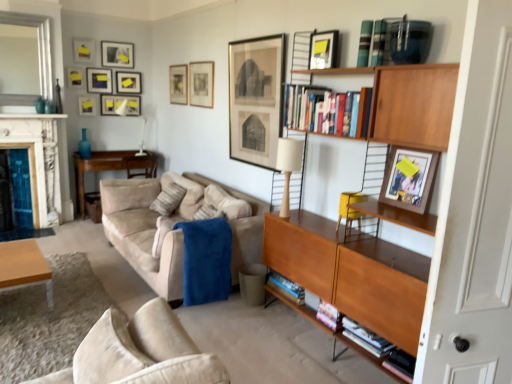
Question: Is marble fireplace at left further to the viewer compared to matte black picture frame at upper center, acting as the tenth picture frame starting from the left?

Choices:
 (A) no
 (B) yes

Answer: (B)

Question: From a real-world perspective, is marble fireplace at left positioned over matte black picture frame at upper center, which ranks as the third picture frame in front-to-back order, based on gravity?

Choices:
 (A) no
 (B) yes

Answer: (A)

Question: Does marble fireplace at left appear on the right side of matte black picture frame at upper center, the 3th picture frame positioned from the right?

Choices:
 (A) yes
 (B) no

Answer: (B)

Question: Are marble fireplace at left and matte black picture frame at upper center, which ranks as the third picture frame in front-to-back order, located far from each other?

Choices:
 (A) yes
 (B) no

Answer: (A)

Question: Is marble fireplace at left aimed at matte black picture frame at upper center, acting as the tenth picture frame starting from the left?

Choices:
 (A) yes
 (B) no

Answer: (B)

Question: Is matte black picture frame at upper center, acting as the tenth picture frame starting from the left, completely or partially inside marble fireplace at left?

Choices:
 (A) no
 (B) yes

Answer: (A)

Question: Is matte black picture frame at upper left, which ranks as the fourth picture frame in left-to-right order, far away from matte black picture frame at upper center, placed as the 1th picture frame when sorted from back to front?

Choices:
 (A) no
 (B) yes

Answer: (A)

Question: Is matte black picture frame at upper left, which is the 4th picture frame in back-to-front order, touching matte black picture frame at upper center, the seventh picture frame from the left?

Choices:
 (A) yes
 (B) no

Answer: (B)

Question: From a real-world perspective, is matte black picture frame at upper left, which ranks as the 9th picture frame in right-to-left order, on matte black picture frame at upper center, placed as the 1th picture frame when sorted from back to front?

Choices:
 (A) no
 (B) yes

Answer: (B)

Question: Considering the relative sizes of matte black picture frame at upper left, which ranks as the 9th picture frame in right-to-left order, and matte black picture frame at upper center, the 6th picture frame positioned from the right, in the image provided, is matte black picture frame at upper left, which ranks as the 9th picture frame in right-to-left order, bigger than matte black picture frame at upper center, the 6th picture frame positioned from the right,?

Choices:
 (A) yes
 (B) no

Answer: (B)

Question: Is matte black picture frame at upper left, which is the 9th picture frame from front to back, at the left side of matte black picture frame at upper center, placed as the 1th picture frame when sorted from back to front?

Choices:
 (A) no
 (B) yes

Answer: (B)

Question: Is matte black picture frame at upper left, which is the 4th picture frame in back-to-front order, smaller than matte black picture frame at upper center, the 6th picture frame positioned from the right?

Choices:
 (A) no
 (B) yes

Answer: (B)

Question: Does matte black picture frame at upper center, which appears as the fifth picture frame when viewed from the right, have a larger size compared to matte black picture frame at upper center, arranged as the eleventh picture frame when viewed from the left?

Choices:
 (A) yes
 (B) no

Answer: (A)